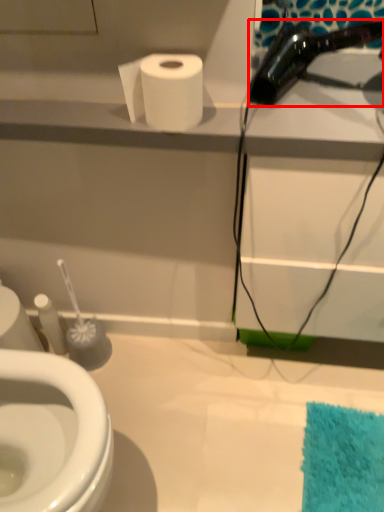
Question: Where is hair drier (annotated by the red box) located in relation to toilet paper in the image?

Choices:
 (A) right
 (B) left

Answer: (A)